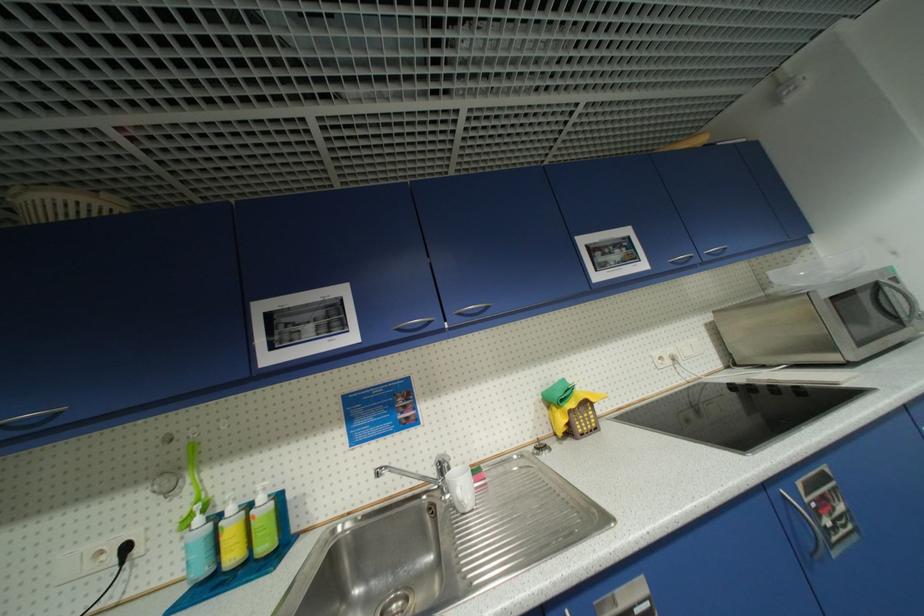
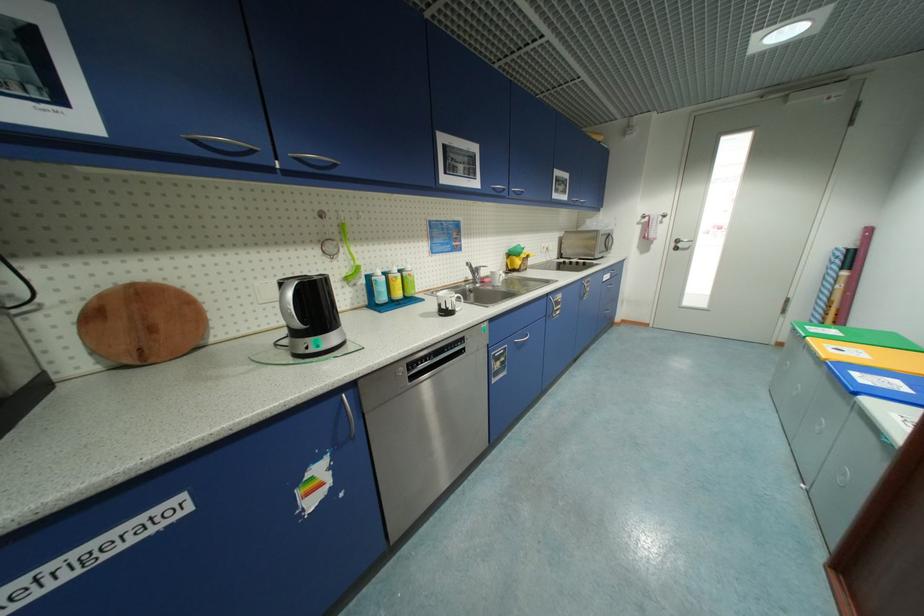
Where in the second image is the point corresponding to the point at 405,331 from the first image?

(499, 190)